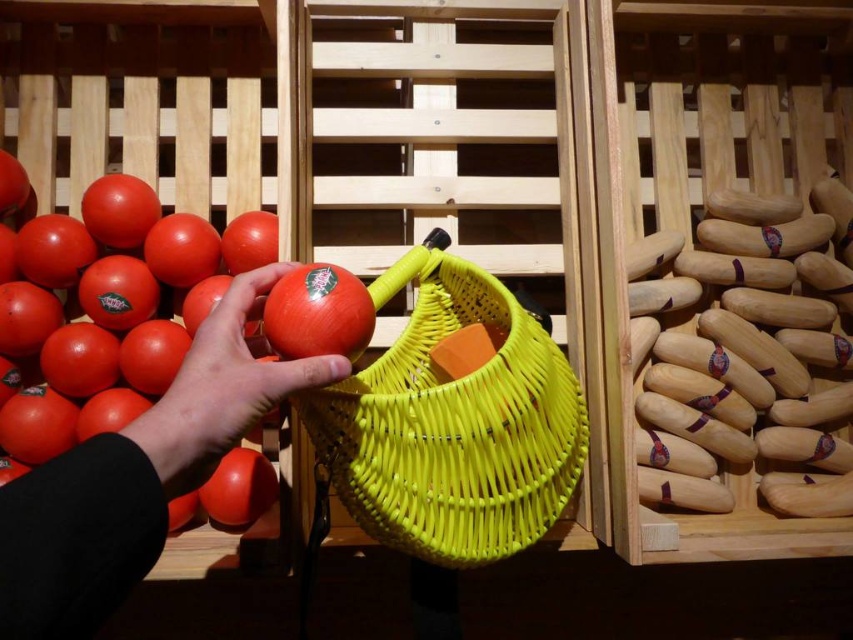
Question: Can you confirm if glossy plastic tomato at left is positioned to the right of glossy plastic tomato at lower left?

Choices:
 (A) no
 (B) yes

Answer: (A)

Question: Among these points, which one is nearest to the camera?

Choices:
 (A) (442, 502)
 (B) (355, 346)
 (C) (213, 496)

Answer: (B)

Question: Which object appears farthest from the camera in this image?

Choices:
 (A) glossy plastic tomato at left
 (B) glossy plastic tomato at lower left
 (C) yellow woven basket at center

Answer: (A)

Question: Does matte orange tomato at center lie in front of glossy orange tomato at center?

Choices:
 (A) no
 (B) yes

Answer: (B)

Question: Which object appears farthest from the camera in this image?

Choices:
 (A) glossy plastic tomato at left
 (B) glossy orange tomato at center

Answer: (A)

Question: Does yellow woven basket at center have a lesser width compared to glossy plastic tomato at lower left?

Choices:
 (A) no
 (B) yes

Answer: (A)